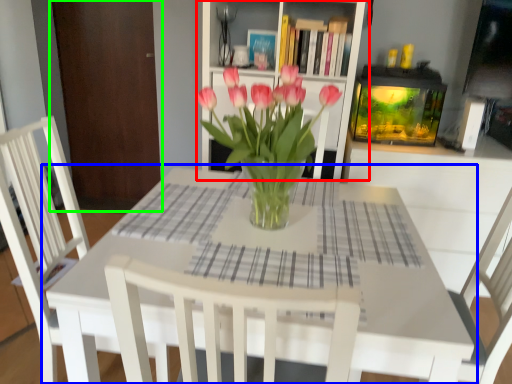
Question: Based on their relative distances, which object is farther from shelf (highlighted by a red box)? Choose from table (highlighted by a blue box) and armoire (highlighted by a green box).

Choices:
 (A) table
 (B) armoire

Answer: (B)